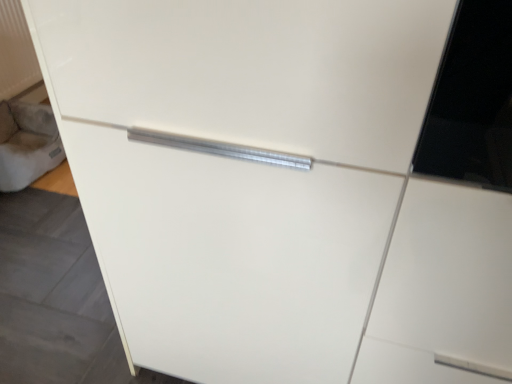
Question: Can suede-like gray cushion at lower left be found inside white textured radiator at upper left?

Choices:
 (A) no
 (B) yes

Answer: (A)

Question: Can we say white textured radiator at upper left lies outside suede-like gray cushion at lower left?

Choices:
 (A) yes
 (B) no

Answer: (A)

Question: From the image's perspective, is white textured radiator at upper left located above suede-like gray cushion at lower left?

Choices:
 (A) no
 (B) yes

Answer: (B)

Question: Are white textured radiator at upper left and suede-like gray cushion at lower left far apart?

Choices:
 (A) no
 (B) yes

Answer: (A)

Question: Considering the relative positions of white textured radiator at upper left and suede-like gray cushion at lower left in the image provided, is white textured radiator at upper left in front of suede-like gray cushion at lower left?

Choices:
 (A) no
 (B) yes

Answer: (A)

Question: Can you confirm if white textured radiator at upper left is thinner than suede-like gray cushion at lower left?

Choices:
 (A) no
 (B) yes

Answer: (B)

Question: Is suede-like gray cushion at lower left at the left side of white textured radiator at upper left?

Choices:
 (A) no
 (B) yes

Answer: (A)

Question: Is suede-like gray cushion at lower left placed right next to white textured radiator at upper left?

Choices:
 (A) no
 (B) yes

Answer: (A)

Question: Is there a large distance between suede-like gray cushion at lower left and white textured radiator at upper left?

Choices:
 (A) no
 (B) yes

Answer: (A)

Question: Does suede-like gray cushion at lower left have a greater width compared to white textured radiator at upper left?

Choices:
 (A) yes
 (B) no

Answer: (A)

Question: From a real-world perspective, is suede-like gray cushion at lower left on white textured radiator at upper left?

Choices:
 (A) no
 (B) yes

Answer: (A)

Question: Does suede-like gray cushion at lower left come in front of white textured radiator at upper left?

Choices:
 (A) yes
 (B) no

Answer: (A)

Question: Looking at the image, does white textured radiator at upper left seem bigger or smaller compared to suede-like gray cushion at lower left?

Choices:
 (A) small
 (B) big

Answer: (A)